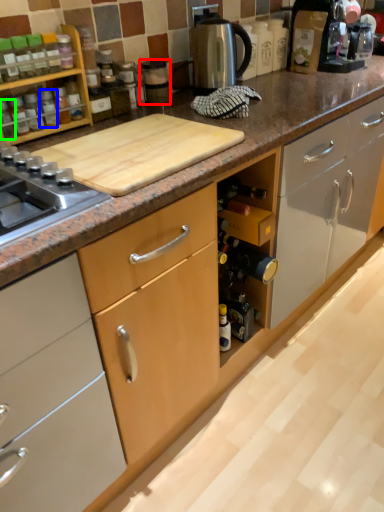
Question: Which is farther away from appliance (highlighted by a red box)? bottle (highlighted by a blue box) or bottle (highlighted by a green box)?

Choices:
 (A) bottle
 (B) bottle

Answer: (B)